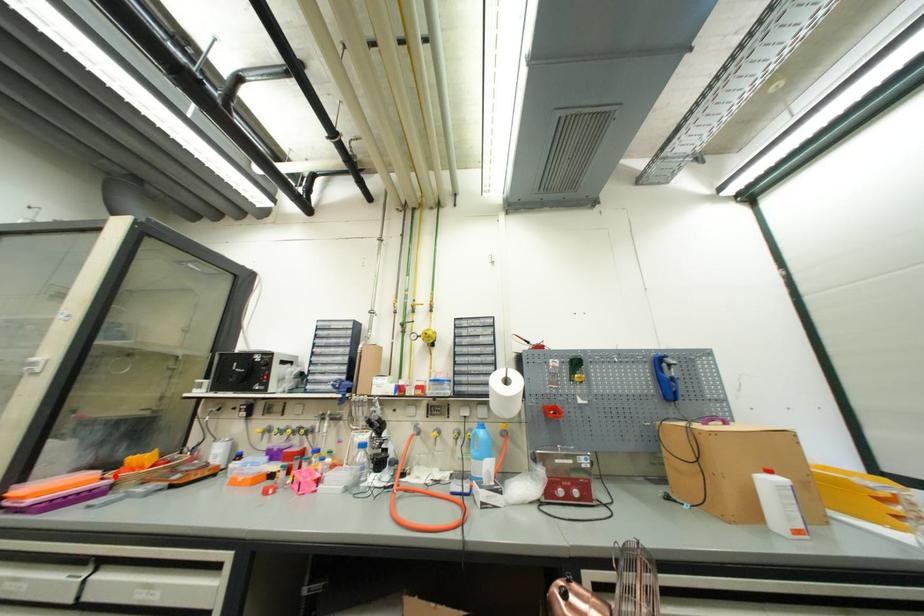
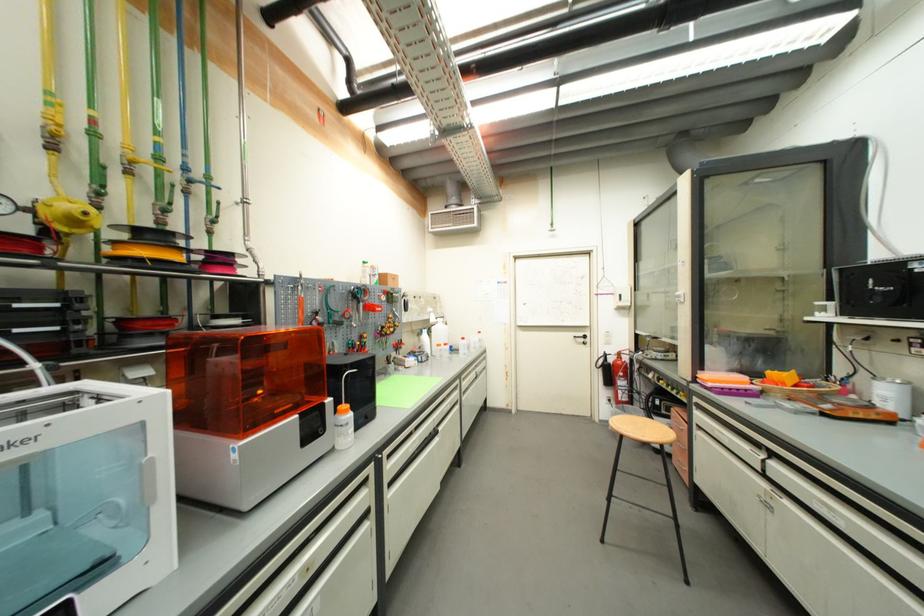
Where in the second image is the point corresponding to the highlighted location from the first image?

(761, 383)